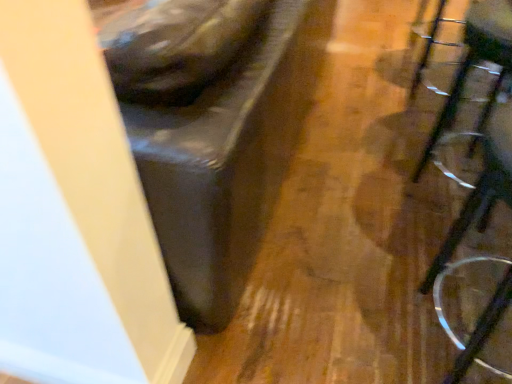
Question: In the image, is clear plastic glasses at right on the left side or the right side of clear plastic swivel chair at right?

Choices:
 (A) right
 (B) left

Answer: (B)

Question: Based on their sizes in the image, would you say clear plastic glasses at right is bigger or smaller than clear plastic swivel chair at right?

Choices:
 (A) small
 (B) big

Answer: (B)

Question: Is point (480, 340) closer or farther from the camera than point (474, 57)?

Choices:
 (A) closer
 (B) farther

Answer: (A)

Question: Considering the relative positions of clear plastic swivel chair at right and clear plastic glasses at right in the image provided, is clear plastic swivel chair at right to the left or to the right of clear plastic glasses at right?

Choices:
 (A) left
 (B) right

Answer: (B)

Question: Which is correct: clear plastic swivel chair at right is inside clear plastic glasses at right, or outside of it?

Choices:
 (A) outside
 (B) inside

Answer: (A)

Question: Looking at their shapes, would you say clear plastic swivel chair at right is wider or thinner than clear plastic glasses at right?

Choices:
 (A) thin
 (B) wide

Answer: (B)

Question: Looking at the image, does clear plastic swivel chair at right seem bigger or smaller compared to clear plastic glasses at right?

Choices:
 (A) big
 (B) small

Answer: (B)